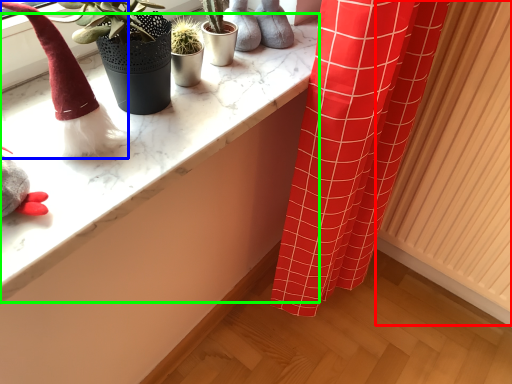
Question: Estimate the real-world distances between objects in this image. Which object is closer to radiator (highlighted by a red box), toy (highlighted by a blue box) or counter top (highlighted by a green box)?

Choices:
 (A) toy
 (B) counter top

Answer: (B)